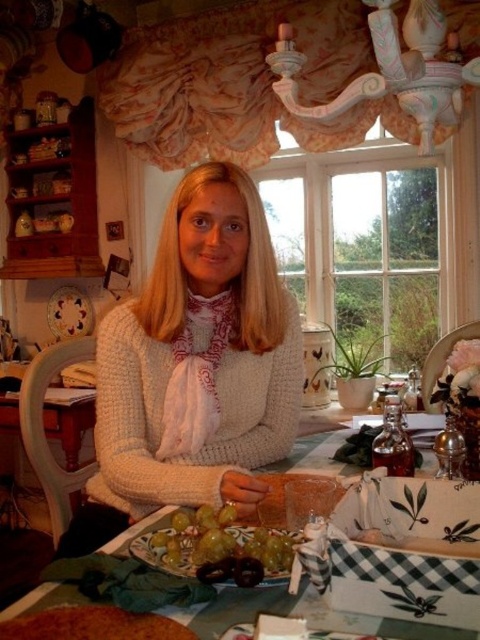
Question: Can you confirm if white knitted sweater at center is positioned to the right of brown crumbly cake at lower left?

Choices:
 (A) yes
 (B) no

Answer: (A)

Question: Which point is farther to the camera?

Choices:
 (A) brown crumbly cake at lower left
 (B) white knitted sweater at center
 (C) green matte grapes at lower center

Answer: (B)

Question: Does green matte plate at lower center appear under brown crumbly cake at lower left?

Choices:
 (A) yes
 (B) no

Answer: (B)

Question: Is green matte plate at lower center thinner than brown crumbly cake at lower left?

Choices:
 (A) no
 (B) yes

Answer: (A)

Question: Which object is closer to the camera taking this photo?

Choices:
 (A) brown crumbly cake at lower left
 (B) green matte grapes at lower center

Answer: (A)

Question: Which point is farther to the camera?

Choices:
 (A) brown crumbly cake at lower left
 (B) white knitted sweater at center
 (C) green matte grapes at lower center

Answer: (B)